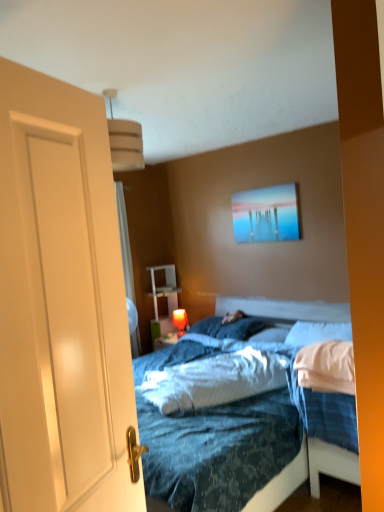
Where is `wooden bed frame at center`? This screenshot has height=512, width=384. wooden bed frame at center is located at coordinates (327, 367).

Describe the element at coordinates (267, 214) in the screenshot. I see `metallic glossy picture frame at upper center` at that location.

I want to click on blue soft pillow at center, acting as the first pillow starting from the left, so pos(229,327).

Find the location of a particular element. matte orange lampshade at center is located at coordinates (180, 321).

What do you see at coordinates (317, 333) in the screenshot? I see `white soft pillow at right, the 1th pillow positioned from the right` at bounding box center [317, 333].

Find the location of `wooden bed frame at center`. wooden bed frame at center is located at coordinates (327, 367).

What are the coordinates of `table lamp located on the left of metallic glossy picture frame at upper center` in the screenshot? It's located at (180, 321).

Is metallic glossy picture frame at upper center positioned with its back to matte orange lampshade at center?

No, matte orange lampshade at center is not at the back of metallic glossy picture frame at upper center.

Considering the relative positions of metallic glossy picture frame at upper center and matte orange lampshade at center in the image provided, is metallic glossy picture frame at upper center in front of matte orange lampshade at center?

That is True.

Which object is wider, metallic glossy picture frame at upper center or matte orange lampshade at center?

matte orange lampshade at center.

How far apart are metallic glossy picture frame at upper center and blue soft pillow at center, the 3th pillow positioned from the right?

metallic glossy picture frame at upper center and blue soft pillow at center, the 3th pillow positioned from the right, are 38.03 inches apart from each other.

Between metallic glossy picture frame at upper center and blue soft pillow at center, the 3th pillow positioned from the right, which one has larger size?

Bigger between the two is blue soft pillow at center, the 3th pillow positioned from the right.

Is metallic glossy picture frame at upper center facing away from blue soft pillow at center, acting as the first pillow starting from the left?

No.

Find the location of a particular element. This screenshot has height=512, width=384. picture frame on the right side of blue soft pillow at center, acting as the first pillow starting from the left is located at coordinates (267, 214).

Is white soft pillow at right, which is the third pillow in left-to-right order, surrounded by blue soft pillow at center, placed as the 2th pillow when sorted from right to left?

No.

There is a blue soft pillow at center, positioned as the 2th pillow in left-to-right order. Identify the location of the 2nd pillow above it (from the image's perspective). (317, 333).

Between blue soft pillow at center, placed as the 2th pillow when sorted from right to left, and white soft pillow at right, the 1th pillow positioned from the right, which one has more height?

white soft pillow at right, the 1th pillow positioned from the right.

Is blue soft pillow at center, placed as the 2th pillow when sorted from right to left, touching white soft pillow at right, which is the third pillow in left-to-right order?

No, blue soft pillow at center, placed as the 2th pillow when sorted from right to left, is not making contact with white soft pillow at right, which is the third pillow in left-to-right order.

Between point (256, 320) and point (331, 386), which one is positioned in front?

Positioned in front is point (331, 386).

Can you confirm if blue soft pillow at center, acting as the first pillow starting from the left, is smaller than wooden bed frame at center?

Yes.

Considering their positions, is blue soft pillow at center, the 3th pillow positioned from the right, located in front of or behind wooden bed frame at center?

In the image, blue soft pillow at center, the 3th pillow positioned from the right, appears behind wooden bed frame at center.

From the image's perspective, between blue soft pillow at center, the 3th pillow positioned from the right, and wooden bed frame at center, which one is located above?

blue soft pillow at center, the 3th pillow positioned from the right, from the image's perspective.

Based on their positions, is matte orange lampshade at center located to the left or right of blue textured mattress at center?

From the image, it's evident that matte orange lampshade at center is to the left of blue textured mattress at center.

How many degrees apart are the facing directions of matte orange lampshade at center and blue textured mattress at center?

28.8 degrees.

Is matte orange lampshade at center bigger or smaller than blue textured mattress at center?

matte orange lampshade at center is smaller than blue textured mattress at center.

From a real-world perspective, starting from the blue textured mattress at center, which pillow is the 2nd one below it? Please provide its 2D coordinates.

[(271, 334)]

Does blue textured mattress at center have a smaller size compared to blue soft pillow at center, placed as the 2th pillow when sorted from right to left?

Actually, blue textured mattress at center might be larger than blue soft pillow at center, placed as the 2th pillow when sorted from right to left.

Is blue textured mattress at center further to camera compared to blue soft pillow at center, positioned as the 2th pillow in left-to-right order?

No, blue textured mattress at center is in front of blue soft pillow at center, positioned as the 2th pillow in left-to-right order.

In the scene shown: What's the angular difference between blue textured mattress at center and blue soft pillow at center, positioned as the 2th pillow in left-to-right order,'s facing directions?

There is a 29.6-degree angle between the facing directions of blue textured mattress at center and blue soft pillow at center, positioned as the 2th pillow in left-to-right order.

Is metallic glossy picture frame at upper center oriented towards wooden bed frame at center?

No, metallic glossy picture frame at upper center does not turn towards wooden bed frame at center.

How many degrees apart are the facing directions of metallic glossy picture frame at upper center and wooden bed frame at center?

The facing directions of metallic glossy picture frame at upper center and wooden bed frame at center are 3.24 degrees apart.

Is metallic glossy picture frame at upper center outside of wooden bed frame at center?

Yes, metallic glossy picture frame at upper center is outside of wooden bed frame at center.

Is metallic glossy picture frame at upper center far from wooden bed frame at center?

metallic glossy picture frame at upper center is positioned a significant distance from wooden bed frame at center.

Image resolution: width=384 pixels, height=512 pixels. Identify the location of table lamp directly beneath the metallic glossy picture frame at upper center (from a real-world perspective). (180, 321).

From the image's perspective, count 2nd pillows downward from the metallic glossy picture frame at upper center and point to it. Please provide its 2D coordinates.

[(229, 327)]

Considering their positions, is blue soft pillow at center, placed as the 2th pillow when sorted from right to left, positioned closer to wooden bed frame at center than white soft pillow at right, the 1th pillow positioned from the right?

Among the two, white soft pillow at right, the 1th pillow positioned from the right, is located nearer to wooden bed frame at center.

When comparing their distances from blue soft pillow at center, the 3th pillow positioned from the right, does blue textured mattress at center or wooden bed frame at center seem further?

wooden bed frame at center.

Looking at the image, which one is located further to blue soft pillow at center, placed as the 2th pillow when sorted from right to left, blue textured mattress at center or blue soft pillow at center, acting as the first pillow starting from the left?

The object further to blue soft pillow at center, placed as the 2th pillow when sorted from right to left, is blue textured mattress at center.

From the image, which object appears to be nearer to wooden bed frame at center, matte orange lampshade at center or white matte door at left?

white matte door at left is positioned closer to the anchor wooden bed frame at center.

Which object lies further to the anchor point blue soft pillow at center, the 3th pillow positioned from the right, metallic glossy picture frame at upper center or white soft pillow at right, which is the third pillow in left-to-right order?

The object further to blue soft pillow at center, the 3th pillow positioned from the right, is metallic glossy picture frame at upper center.

Which object lies further to the anchor point blue textured mattress at center, metallic glossy picture frame at upper center or white soft pillow at right, the 1th pillow positioned from the right?

metallic glossy picture frame at upper center lies further to blue textured mattress at center than the other object.

Which object lies nearer to the anchor point wooden bed frame at center, white matte door at left or matte orange lampshade at center?

Based on the image, white matte door at left appears to be nearer to wooden bed frame at center.

Which object lies further to the anchor point matte orange lampshade at center, blue soft pillow at center, placed as the 2th pillow when sorted from right to left, or wooden bed frame at center?

wooden bed frame at center lies further to matte orange lampshade at center than the other object.

This screenshot has width=384, height=512. I want to click on mattress located between wooden bed frame at center and matte orange lampshade at center in the depth direction, so click(x=214, y=380).

The height and width of the screenshot is (512, 384). Identify the location of mattress located between wooden bed frame at center and blue soft pillow at center, the 3th pillow positioned from the right, in the depth direction. (214, 380).

At what (x,y) coordinates should I click in order to perform the action: click on picture frame located between blue textured mattress at center and matte orange lampshade at center in the depth direction. Please return your answer as a coordinate pair (x, y). The width and height of the screenshot is (384, 512). Looking at the image, I should click on (267, 214).

The height and width of the screenshot is (512, 384). Find the location of `pillow between metallic glossy picture frame at upper center and blue soft pillow at center, the 3th pillow positioned from the right, in the vertical direction`. pillow between metallic glossy picture frame at upper center and blue soft pillow at center, the 3th pillow positioned from the right, in the vertical direction is located at coordinates (317, 333).